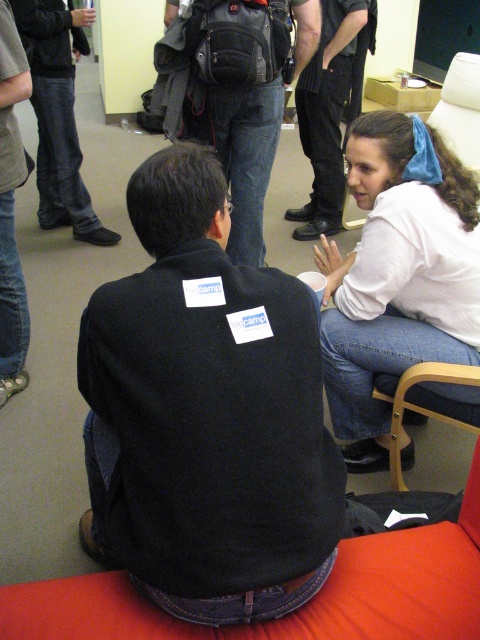
Question: Does white cotton shirt at upper right appear under red fabric swivel chair at lower center?

Choices:
 (A) yes
 (B) no

Answer: (B)

Question: Which object is farther from the camera taking this photo?

Choices:
 (A) black fleece jacket at center
 (B) red fabric swivel chair at lower center
 (C) jeans at left
 (D) black fleece jacket at lower left

Answer: (C)

Question: Can you confirm if black fleece jacket at center is positioned below white cotton shirt at upper right?

Choices:
 (A) yes
 (B) no

Answer: (A)

Question: From the image, what is the correct spatial relationship of black leather pants at center in relation to black fleece jacket at lower left?

Choices:
 (A) above
 (B) below

Answer: (A)

Question: Which is farther from the black fleece jacket at center?

Choices:
 (A) black fleece jacket at lower left
 (B) black leather pants at center
 (C) jeans at left
 (D) matte black backpack at center

Answer: (B)

Question: Which point is closer to the camera taking this photo?

Choices:
 (A) (317, 8)
 (B) (312, 212)

Answer: (A)